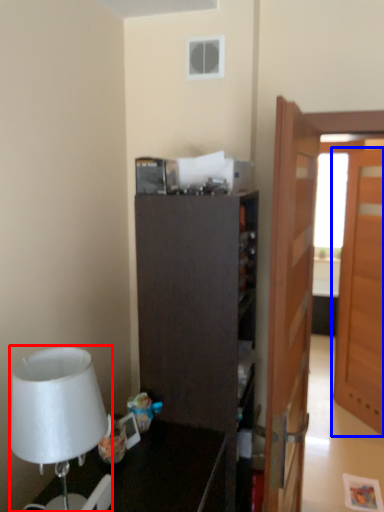
Question: Which object is further to the camera taking this photo, lamp (highlighted by a red box) or door (highlighted by a blue box)?

Choices:
 (A) lamp
 (B) door

Answer: (B)